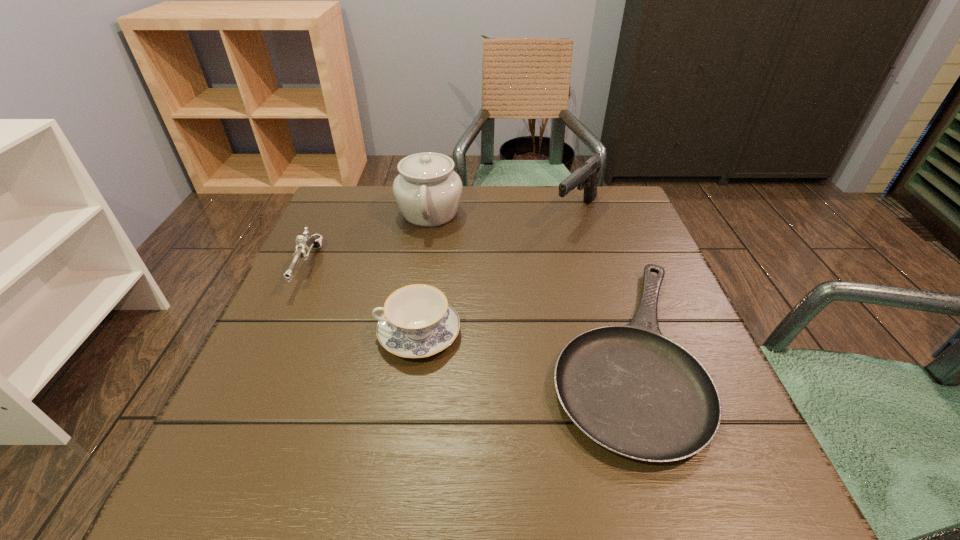
Locate an element on the screen. vacant position in the image that satisfies the following two spatial constraints: 1. aimed along the barrel of the nearer gun; 2. with the handle on the side of the nearer chinaware is located at coordinates (277, 334).

This screenshot has height=540, width=960. Find the location of `vacant region that satisfies the following two spatial constraints: 1. aimed along the barrel of the shorter gun; 2. with the handle on the side of the nearer chinaware`. vacant region that satisfies the following two spatial constraints: 1. aimed along the barrel of the shorter gun; 2. with the handle on the side of the nearer chinaware is located at coordinates (277, 334).

The height and width of the screenshot is (540, 960). In order to click on vacant position in the image that satisfies the following two spatial constraints: 1. with the handle on the side of the nearer chinaware; 2. aimed along the barrel of the leftmost object in this screenshot , I will do `click(427, 267)`.

Where is `free space that satisfies the following two spatial constraints: 1. aimed along the barrel of the nearer gun; 2. with the handle on the side of the nearer chinaware`? Image resolution: width=960 pixels, height=540 pixels. free space that satisfies the following two spatial constraints: 1. aimed along the barrel of the nearer gun; 2. with the handle on the side of the nearer chinaware is located at coordinates (277, 334).

Identify the location of free region that satisfies the following two spatial constraints: 1. at the muzzle of the right gun; 2. on the left side of the shortest object. The image size is (960, 540). (617, 351).